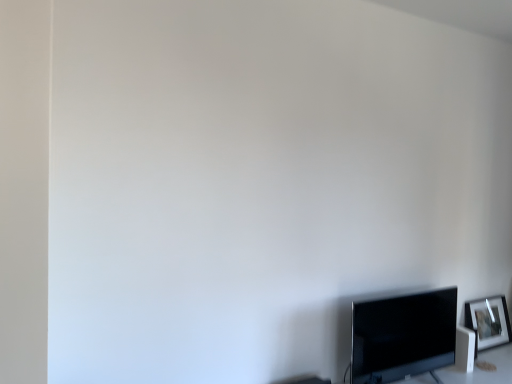
Question: Would you say silver metallic picture frame at lower right is a long distance from matte black tv at lower right?

Choices:
 (A) yes
 (B) no

Answer: (B)

Question: Considering the relative sizes of silver metallic picture frame at lower right and matte black tv at lower right in the image provided, is silver metallic picture frame at lower right smaller than matte black tv at lower right?

Choices:
 (A) yes
 (B) no

Answer: (A)

Question: Does silver metallic picture frame at lower right turn towards matte black tv at lower right?

Choices:
 (A) no
 (B) yes

Answer: (A)

Question: Can you confirm if silver metallic picture frame at lower right is positioned to the right of matte black tv at lower right?

Choices:
 (A) yes
 (B) no

Answer: (A)

Question: Does silver metallic picture frame at lower right have a lesser width compared to matte black tv at lower right?

Choices:
 (A) no
 (B) yes

Answer: (B)

Question: Does silver metallic picture frame at lower right have a greater width compared to matte black tv at lower right?

Choices:
 (A) yes
 (B) no

Answer: (B)

Question: Considering the relative sizes of matte black tv at lower right and silver metallic picture frame at lower right in the image provided, is matte black tv at lower right wider than silver metallic picture frame at lower right?

Choices:
 (A) yes
 (B) no

Answer: (A)

Question: Is matte black tv at lower right positioned in front of silver metallic picture frame at lower right?

Choices:
 (A) no
 (B) yes

Answer: (B)

Question: Can you confirm if matte black tv at lower right is thinner than silver metallic picture frame at lower right?

Choices:
 (A) yes
 (B) no

Answer: (B)

Question: Is matte black tv at lower right shorter than silver metallic picture frame at lower right?

Choices:
 (A) no
 (B) yes

Answer: (A)

Question: Is matte black tv at lower right with silver metallic picture frame at lower right?

Choices:
 (A) no
 (B) yes

Answer: (A)

Question: From a real-world perspective, is matte black tv at lower right under silver metallic picture frame at lower right?

Choices:
 (A) yes
 (B) no

Answer: (B)

Question: Is matte black tv at lower right inside the boundaries of silver metallic picture frame at lower right, or outside?

Choices:
 (A) outside
 (B) inside

Answer: (A)